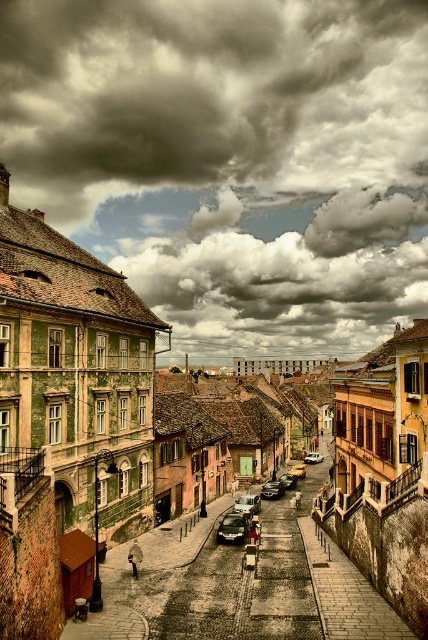
Does sepia-toned stone buildings at center appear over shiny black sedan at center?

Yes, sepia-toned stone buildings at center is above shiny black sedan at center.

Measure the distance from sepia-toned stone buildings at center to shiny black sedan at center.

sepia-toned stone buildings at center is 46.62 meters from shiny black sedan at center.

Identify the location of sepia-toned stone buildings at center. click(x=68, y=404).

Find the location of a particular element. sepia-toned stone buildings at center is located at coordinates (68, 404).

Based on the photo, between shiny black car at center and shiny black sedan at center, which one is positioned lower?

shiny black sedan at center is below.

Does shiny black car at center appear over shiny black sedan at center?

Indeed, shiny black car at center is positioned over shiny black sedan at center.

Is point (229, 513) closer to viewer compared to point (296, 477)?

Yes, point (229, 513) is closer to viewer.

Where is `shiny black car at center`? This screenshot has height=640, width=428. shiny black car at center is located at coordinates click(232, 529).

Is matte stone alley at center closer to the viewer compared to shiny black sedan at center?

Yes, it is in front of shiny black sedan at center.

Between point (211, 566) and point (285, 486), which one is positioned in front?

Point (211, 566) is in front.

Where is `matte stone alley at center`? matte stone alley at center is located at coordinates (240, 584).

Find the location of `matte stone alley at center`. matte stone alley at center is located at coordinates (240, 584).